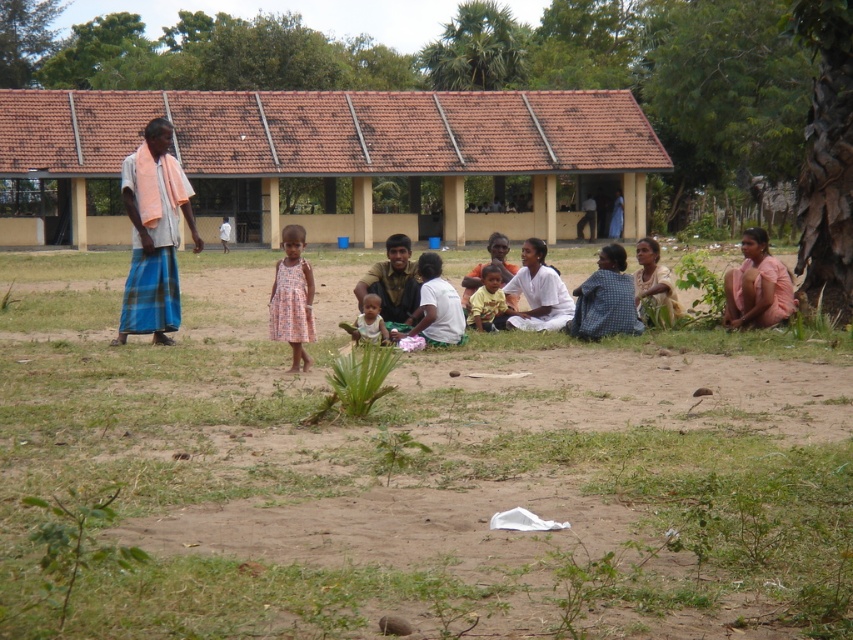
You are standing in front of the building and want to pick up the white cloth at center and the light brown fabric dress at right. Which item do you need to walk closer to first?

You need to pick up the white cloth at center first because it is closer to you than the light brown fabric dress at right.

In the scene shown: You are a parent trying to locate your child who is playing in the area. You see the brown tiled roof at upper center and the light brown fabric child at center. How far apart are these two objects?

The distance between the brown tiled roof at upper center and the light brown fabric child at center is 7.81 meters.